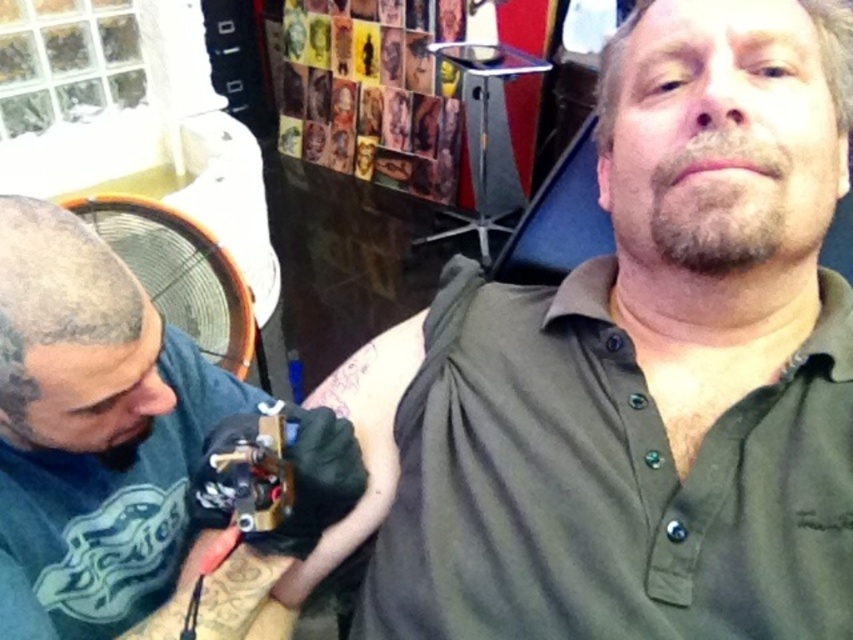
Who is positioned more to the left, green matte shirt at upper right or black matte tattoo gun at left?

black matte tattoo gun at left is more to the left.

Does green matte shirt at upper right have a lesser height compared to black matte tattoo gun at left?

No.

At what (x,y) coordinates should I click in order to perform the action: click on green matte shirt at upper right. Please return your answer as a coordinate pair (x, y). Looking at the image, I should click on (637, 374).